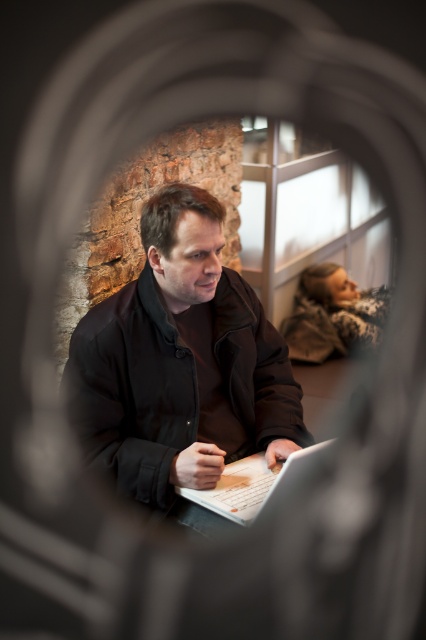
Question: Which point is closer to the camera?

Choices:
 (A) matte black laptop at center
 (B) white matte laptop at center

Answer: (B)

Question: Is matte black laptop at center smaller than white matte laptop at center?

Choices:
 (A) yes
 (B) no

Answer: (B)

Question: Is matte black laptop at center to the left of white matte laptop at center from the viewer's perspective?

Choices:
 (A) no
 (B) yes

Answer: (B)

Question: Can you confirm if matte black laptop at center is positioned to the left of white matte laptop at center?

Choices:
 (A) no
 (B) yes

Answer: (B)

Question: Which object appears farthest from the camera in this image?

Choices:
 (A) matte black laptop at center
 (B) white matte laptop at center

Answer: (A)

Question: Which point is closer to the camera?

Choices:
 (A) (256, 509)
 (B) (241, 332)

Answer: (A)